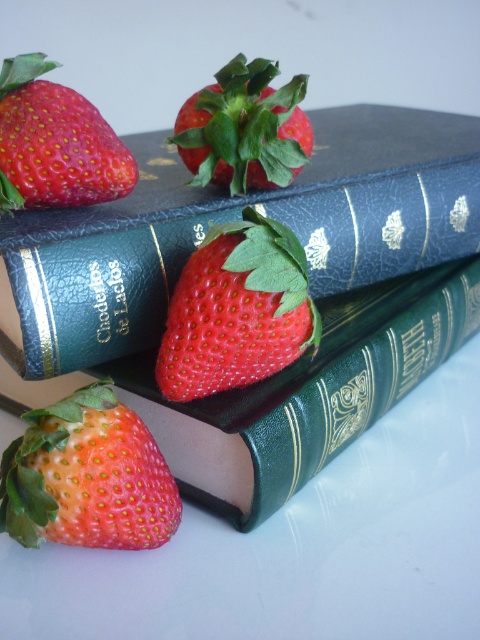
Is shiny red strawberry at center positioned behind glossy red strawberry at center?

No, shiny red strawberry at center is closer to the viewer.

Where is `shiny red strawberry at center`? This screenshot has height=640, width=480. shiny red strawberry at center is located at coordinates (237, 310).

Consider the image. Between green leather book at center and shiny red strawberry at upper left, which one appears on the left side from the viewer's perspective?

Positioned to the left is shiny red strawberry at upper left.

Does green leather book at center appear on the right side of shiny red strawberry at upper left?

Yes, green leather book at center is to the right of shiny red strawberry at upper left.

Which is in front, point (405, 364) or point (26, 92)?

Point (26, 92) is more forward.

This screenshot has width=480, height=640. Find the location of `green leather book at center`. green leather book at center is located at coordinates (317, 385).

Between point (166, 522) and point (273, 275), which one is positioned behind?

Positioned behind is point (166, 522).

Does shiny red strawberry at lower left have a larger size compared to shiny red strawberry at center?

No.

Does point (24, 432) come behind point (220, 369)?

That is True.

Locate an element on the screen. This screenshot has width=480, height=640. shiny red strawberry at lower left is located at coordinates (86, 476).